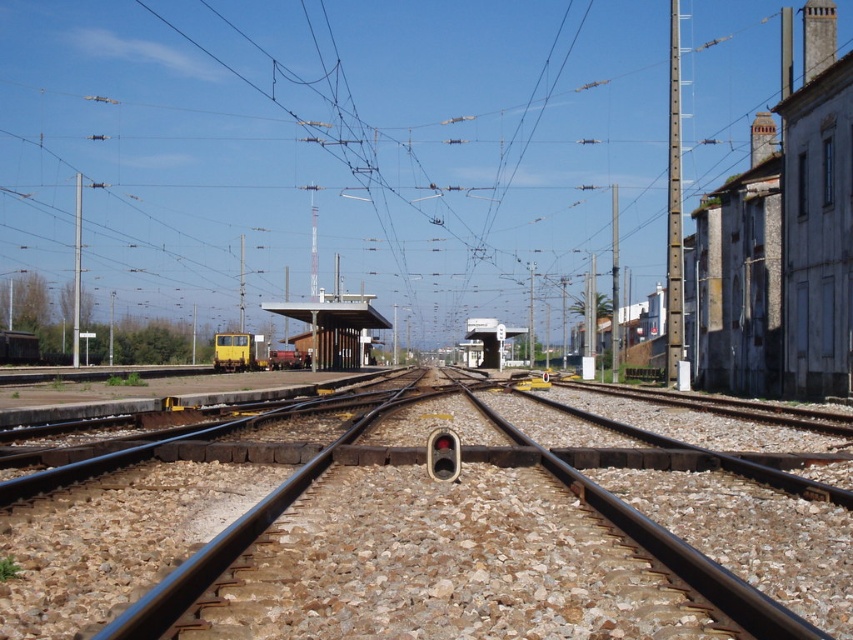
Question: Which point appears closest to the camera in this image?

Choices:
 (A) (589, 620)
 (B) (334, 304)
 (C) (469, 365)

Answer: (A)

Question: Can you confirm if metal at center is positioned above white plastic railway station at center?

Choices:
 (A) yes
 (B) no

Answer: (B)

Question: Which of the following is the farthest from the observer?

Choices:
 (A) [331, 342]
 (B) [187, 592]

Answer: (A)

Question: Which point is closer to the camera?

Choices:
 (A) white concrete platform at center
 (B) metal at center

Answer: (B)

Question: Can you confirm if white concrete platform at center is positioned to the left of white plastic railway station at center?

Choices:
 (A) no
 (B) yes

Answer: (B)

Question: Is metal at center bigger than white plastic railway station at center?

Choices:
 (A) yes
 (B) no

Answer: (B)